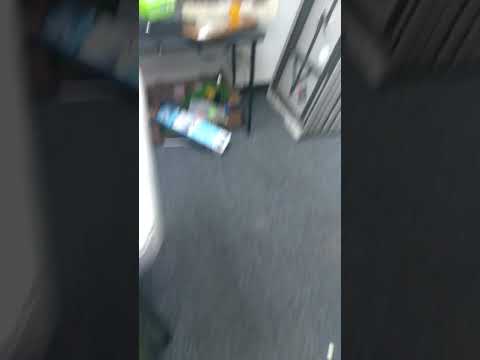
Image resolution: width=480 pixels, height=360 pixels. In order to click on background table legs in this screenshot , I will do `click(304, 50)`, `click(327, 13)`.